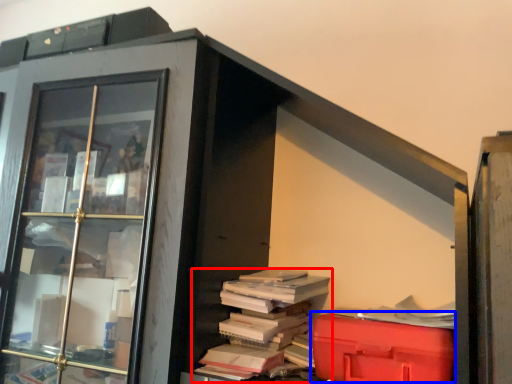
Question: Which point is closer to the camera, book (highlighted by a red box) or waste (highlighted by a blue box)?

Choices:
 (A) book
 (B) waste

Answer: (B)